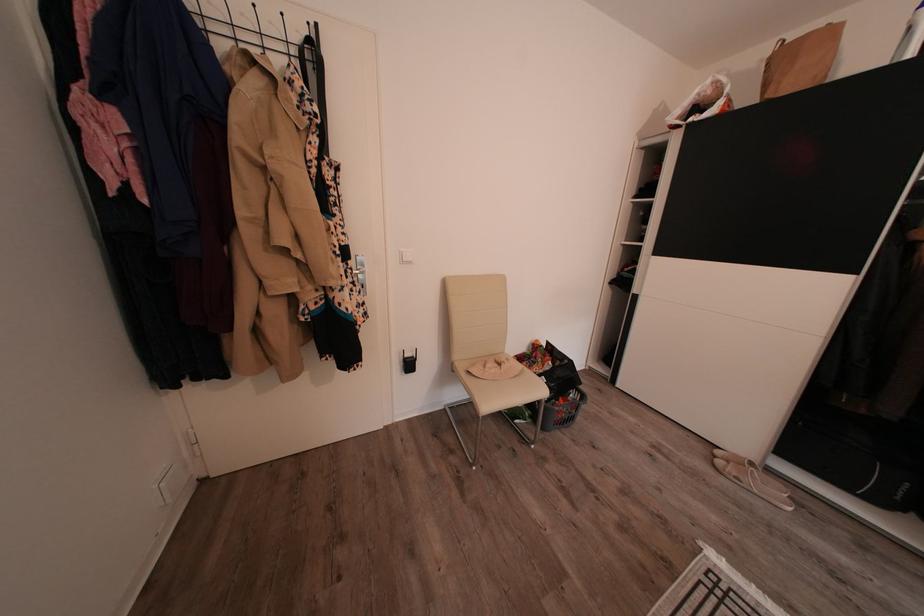
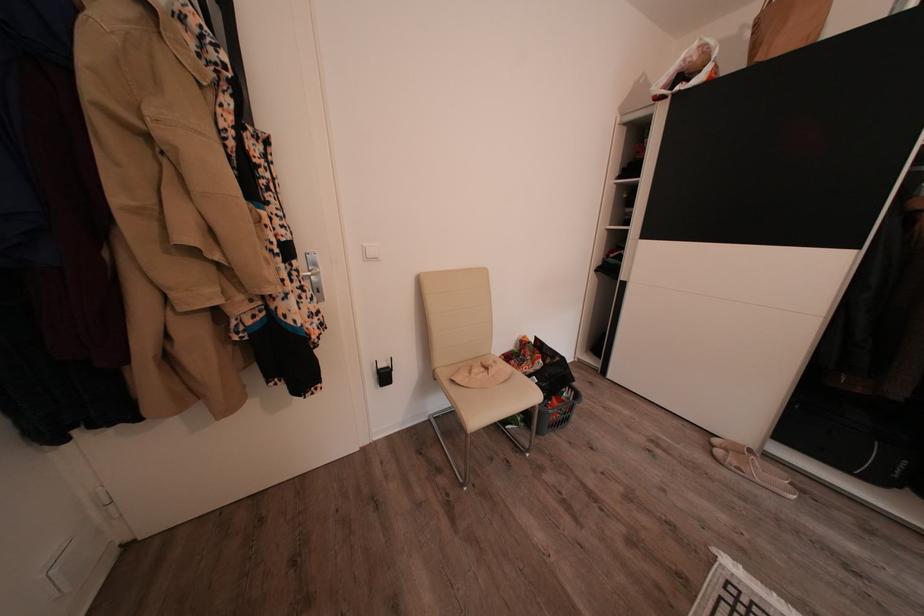
Question: In a continuous first-person perspective shot, in which direction is the camera moving?

Choices:
 (A) Left
 (B) Right
 (C) Forward
 (D) Backward

Answer: (C)